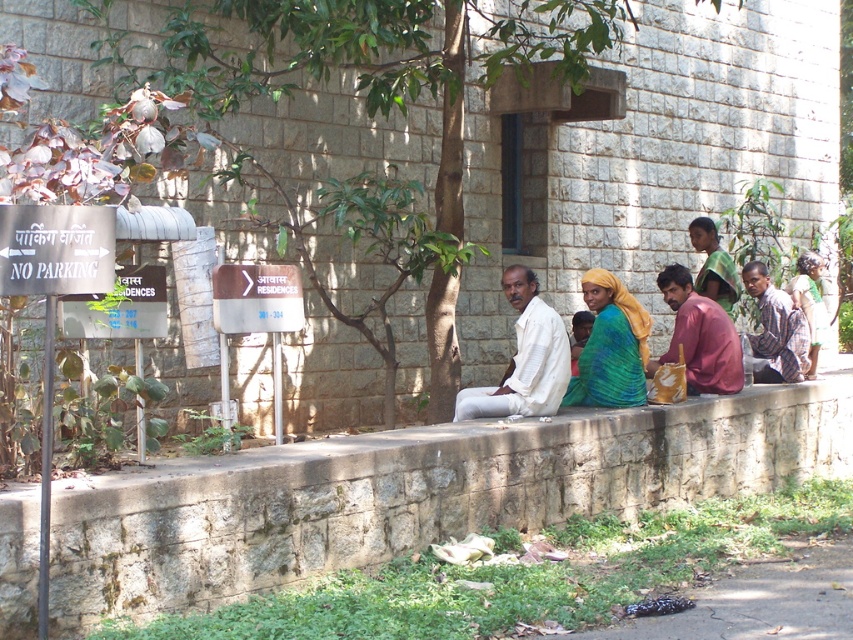
Can you confirm if stone ledge at center is positioned to the left of green leafy tree at center?

In fact, stone ledge at center is to the right of green leafy tree at center.

Does point (706, 476) come in front of point (115, 49)?

No, it is not.

Find the location of a particular element. stone ledge at center is located at coordinates 416,493.

Which is in front, point (695, 332) or point (703, 250)?

Point (695, 332) is in front.

Can you confirm if maroon fabric shirt at center is smaller than green fabric headscarf at upper right?

Actually, maroon fabric shirt at center might be larger than green fabric headscarf at upper right.

At what (x,y) coordinates should I click in order to perform the action: click on maroon fabric shirt at center. Please return your answer as a coordinate pair (x, y). Image resolution: width=853 pixels, height=640 pixels. Looking at the image, I should click on (699, 337).

Can you confirm if green textured fabric at center is smaller than green fabric headscarf at upper right?

Yes.

Locate an element on the screen. This screenshot has width=853, height=640. green textured fabric at center is located at coordinates (610, 346).

Where is `green textured fabric at center`? green textured fabric at center is located at coordinates (610, 346).